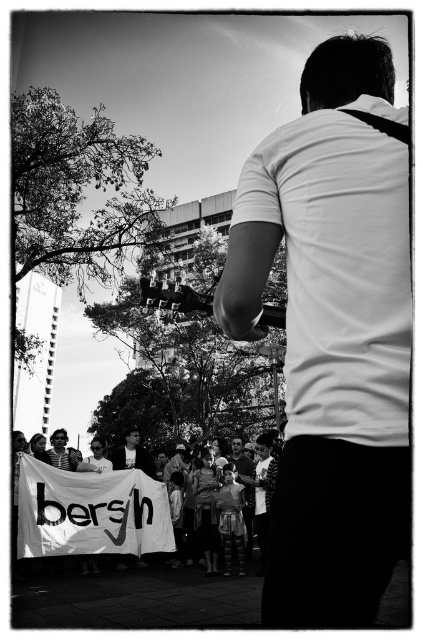
Question: Which of the following is the closest to the observer?

Choices:
 (A) white smooth shirt at center
 (B) white paper banner at lower left

Answer: (A)

Question: Can you confirm if white smooth shirt at center is wider than white paper banner at lower left?

Choices:
 (A) yes
 (B) no

Answer: (B)

Question: Can you confirm if white smooth shirt at center is smaller than white paper banner at lower left?

Choices:
 (A) no
 (B) yes

Answer: (B)

Question: Where is white smooth shirt at center located in relation to white paper banner at lower left in the image?

Choices:
 (A) above
 (B) below

Answer: (A)

Question: Which point appears closest to the camera in this image?

Choices:
 (A) (173, 536)
 (B) (318, 420)

Answer: (B)